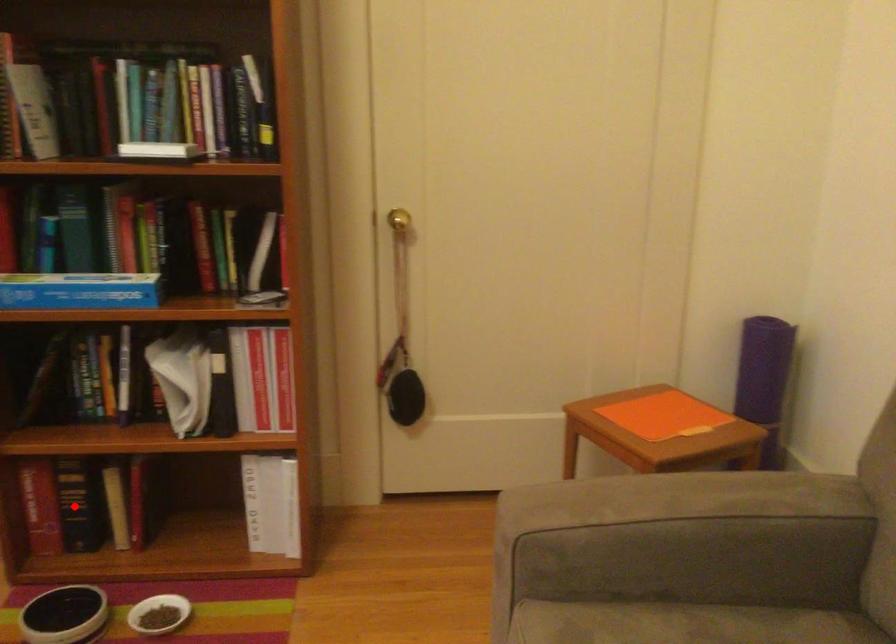
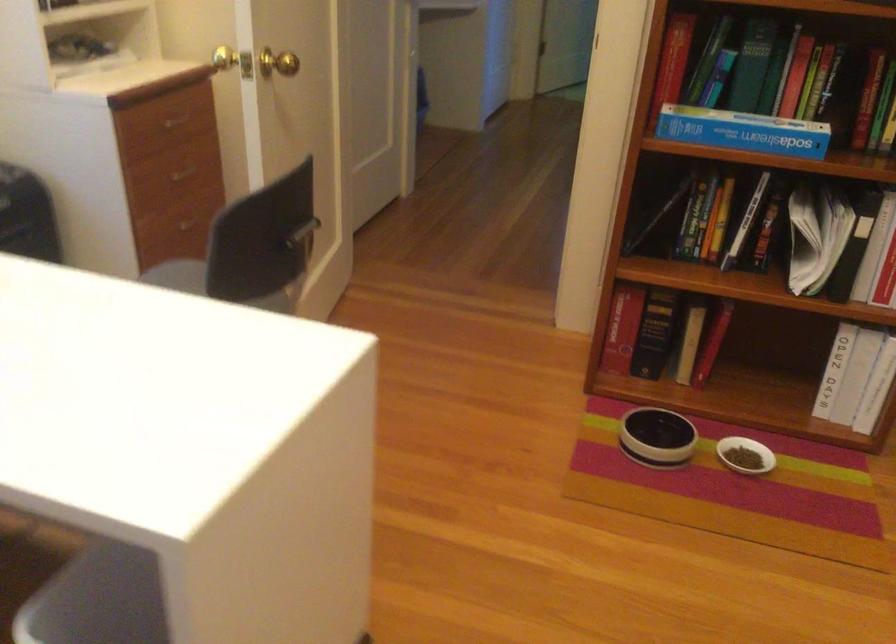
The point at the highlighted location is marked in the first image. Where is the corresponding point in the second image?

(655, 334)